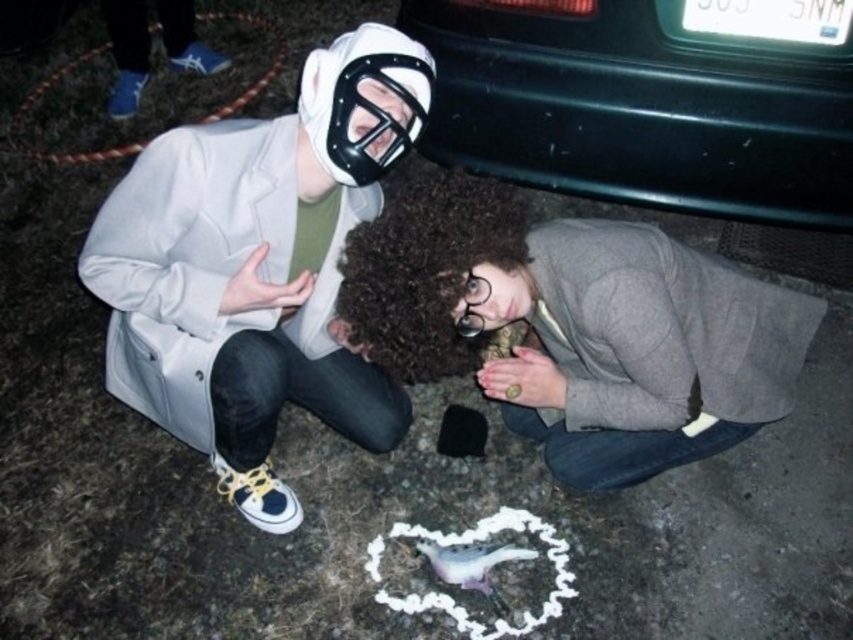
Between white matte mask at upper left and gray wool sweater at lower center, which one appears on the left side from the viewer's perspective?

From the viewer's perspective, white matte mask at upper left appears more on the left side.

Does white matte mask at upper left have a smaller size compared to gray wool sweater at lower center?

Indeed, white matte mask at upper left has a smaller size compared to gray wool sweater at lower center.

Who is more distant from viewer, (239, 292) or (374, 317)?

Point (239, 292)

Where is `white matte mask at upper left`? This screenshot has width=853, height=640. white matte mask at upper left is located at coordinates (257, 268).

Between point (514, 406) and point (554, 131), which one is positioned in front?

Point (514, 406)

Does point (474, 256) lie in front of point (614, 144)?

Yes, it is.

The image size is (853, 640). Identify the location of gray wool sweater at lower center. (576, 326).

Is white matte mask at upper left bigger than black plastic car at upper right?

Indeed, white matte mask at upper left has a larger size compared to black plastic car at upper right.

Is white matte mask at upper left positioned in front of black plastic car at upper right?

That is True.

Image resolution: width=853 pixels, height=640 pixels. I want to click on white matte mask at upper left, so click(x=257, y=268).

At what (x,y) coordinates should I click in order to perform the action: click on white matte mask at upper left. Please return your answer as a coordinate pair (x, y). This screenshot has width=853, height=640. Looking at the image, I should click on (257, 268).